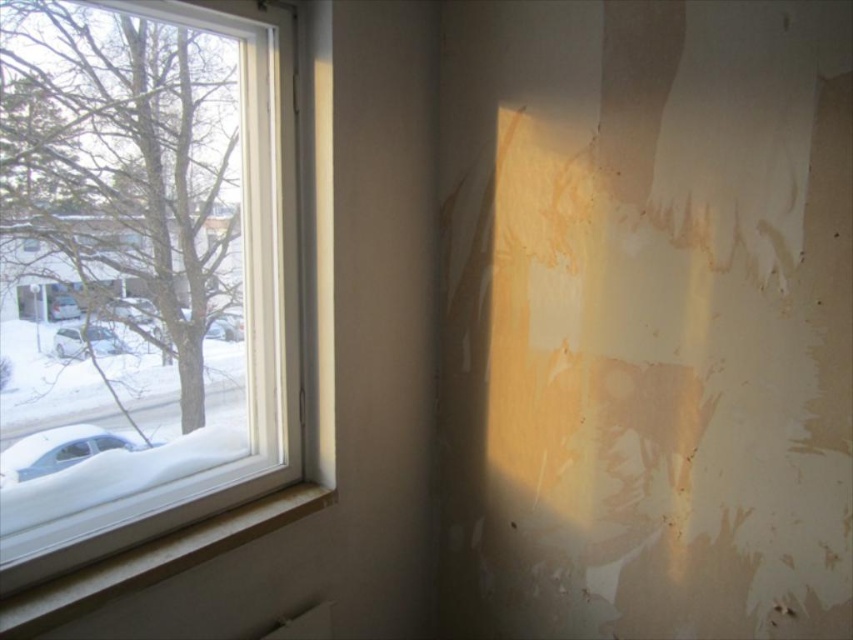
You are standing in the room and want to know which object is taller between the white plastic window at left and the white glossy car at left. Can you determine this based on their positions?

The white plastic window at left has a greater height compared to the white glossy car at left, so the white plastic window at left is taller.

You are trying to determine the position of the white plastic window at left relative to the white matte car at left in the snowy scene. Based on the description, is the window above or below the car?

The white plastic window at left is located above the white matte car at left.

You are standing in the room and want to place a small potted plant between the white wood at lower left and the white glossy car at left. Based on their positions, where should you place the plant?

The white wood at lower left is to the right of the white glossy car at left, so you should place the plant between them by positioning it to the right of the white glossy car at left and to the left of the white wood at lower left.